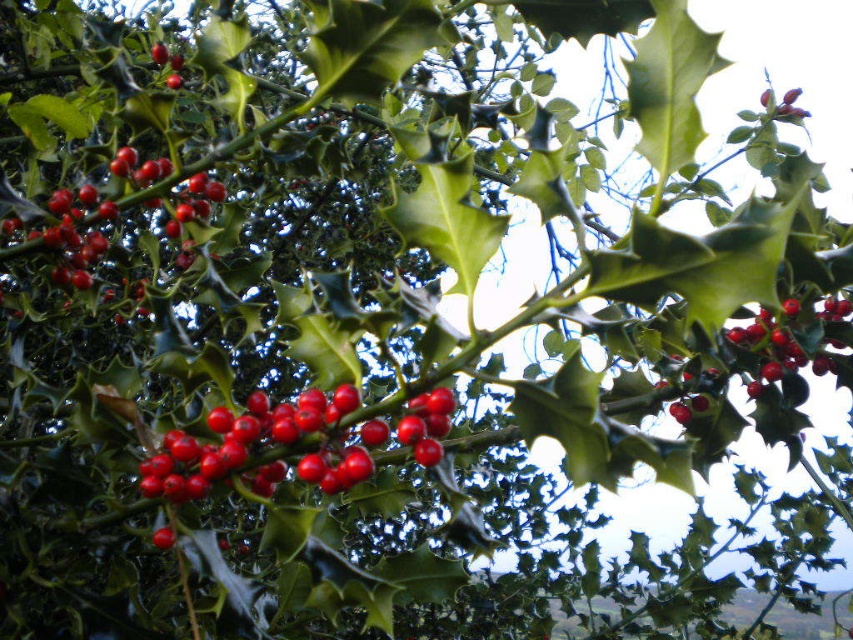
You are a botanist examining a holly bush. You notice a specific point at coordinates point (265, 442). Based on the image, what part of the holly bush is located at this point?

The point (265, 442) is on glossy red berries at center.

You are an artist painting a holly bush and want to ensure the berries are accurately sized. You notice two clusters of glossy red berries at upper right and glossy red berries at upper left. Which cluster should you paint larger to match the image?

The glossy red berries at upper right should be painted larger than the glossy red berries at upper left to match the image.